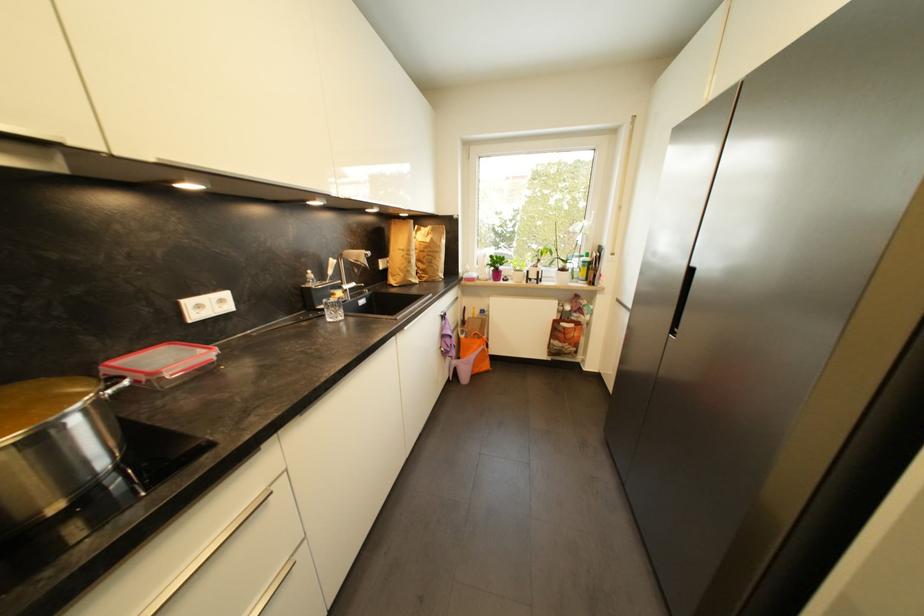
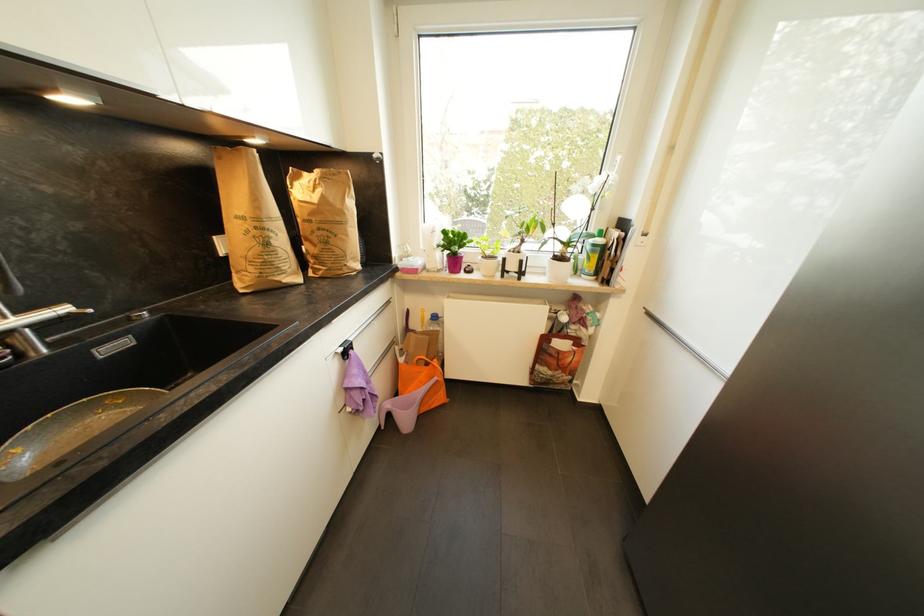
Find the pixel in the second image that matches [589,264] in the first image.

(599, 246)